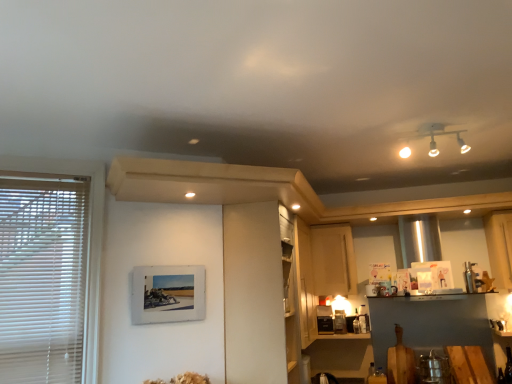
Question: From a real-world perspective, is wooden picture frame at lower left over white matte cabinet at center, which appears as the second cabinetry when viewed from the back?

Choices:
 (A) no
 (B) yes

Answer: (B)

Question: From the image's perspective, would you say wooden picture frame at lower left is shown under white matte cabinet at center, which appears as the second cabinetry when viewed from the back?

Choices:
 (A) no
 (B) yes

Answer: (A)

Question: Is wooden picture frame at lower left at the left side of white matte cabinet at center, the first cabinetry when ordered from front to back?

Choices:
 (A) no
 (B) yes

Answer: (B)

Question: Would you say wooden picture frame at lower left is a long distance from white matte cabinet at center, which appears as the second cabinetry when viewed from the back?

Choices:
 (A) yes
 (B) no

Answer: (B)

Question: From a real-world perspective, is wooden picture frame at lower left beneath white matte cabinet at center, marked as the 1th cabinetry in a left-to-right arrangement?

Choices:
 (A) yes
 (B) no

Answer: (B)

Question: Does wooden picture frame at lower left have a greater height compared to white matte cabinet at center, the first cabinetry when ordered from front to back?

Choices:
 (A) yes
 (B) no

Answer: (B)

Question: Is light wood cabinet at center, which appears as the first cabinetry when viewed from the right, closer to camera compared to white blinds at left?

Choices:
 (A) no
 (B) yes

Answer: (A)

Question: From a real-world perspective, is light wood cabinet at center, which appears as the first cabinetry when viewed from the right, on top of white blinds at left?

Choices:
 (A) yes
 (B) no

Answer: (A)

Question: Considering the relative sizes of light wood cabinet at center, marked as the 1th cabinetry in a back-to-front arrangement, and white blinds at left in the image provided, is light wood cabinet at center, marked as the 1th cabinetry in a back-to-front arrangement, thinner than white blinds at left?

Choices:
 (A) no
 (B) yes

Answer: (A)

Question: Does light wood cabinet at center, positioned as the 2th cabinetry in left-to-right order, have a lesser height compared to white blinds at left?

Choices:
 (A) yes
 (B) no

Answer: (A)

Question: Does light wood cabinet at center, which appears as the first cabinetry when viewed from the right, appear on the left side of white blinds at left?

Choices:
 (A) yes
 (B) no

Answer: (B)

Question: Can you confirm if light wood cabinet at center, which appears as the first cabinetry when viewed from the right, is smaller than white blinds at left?

Choices:
 (A) no
 (B) yes

Answer: (A)

Question: Is white blinds at left looking in the opposite direction of white matte cabinet at center, which appears as the second cabinetry when viewed from the back?

Choices:
 (A) no
 (B) yes

Answer: (A)